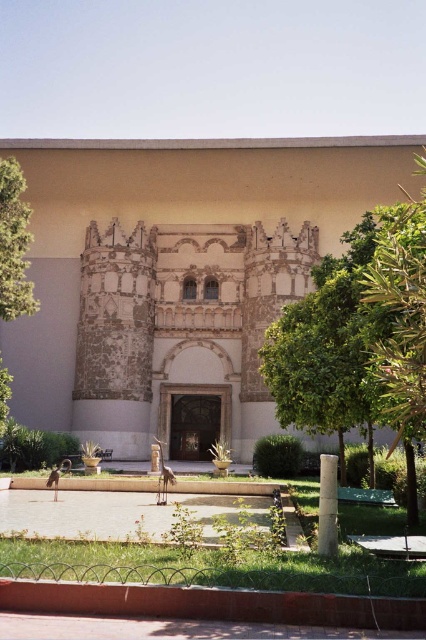
You are standing in front of the historical building. There is a point marked at coordinates (400,326). What object is located at this point?

The green leafy tree at right is located at point (400,326).

You are an architect analyzing the historical building. You notice the stone mosaic palace at center and the green leafy tree at left. Which structure has a greater height?

The stone mosaic palace at center is taller than the green leafy tree at left according to the description.

You are a landscape architect designing a new garden pathway that must pass between the stone mosaic palace at center and the green leafy tree at left. The pathway needs to be at least 2 meters wide to accommodate visitors. Can the existing space between them accommodate this width?

The distance between the stone mosaic palace at center and the green leafy tree at left is 19.32 meters, which is more than sufficient to accommodate a 2 meter wide pathway between them.